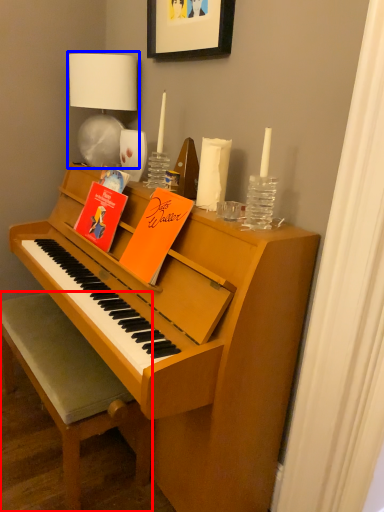
Question: Which object appears farthest to the camera in this image, chair (highlighted by a red box) or table lamp (highlighted by a blue box)?

Choices:
 (A) chair
 (B) table lamp

Answer: (B)